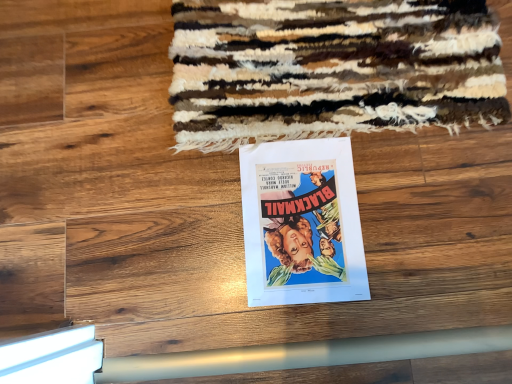
Find the location of a particular element. This screenshot has height=384, width=512. free spot to the right of matte paper poster at center is located at coordinates (423, 202).